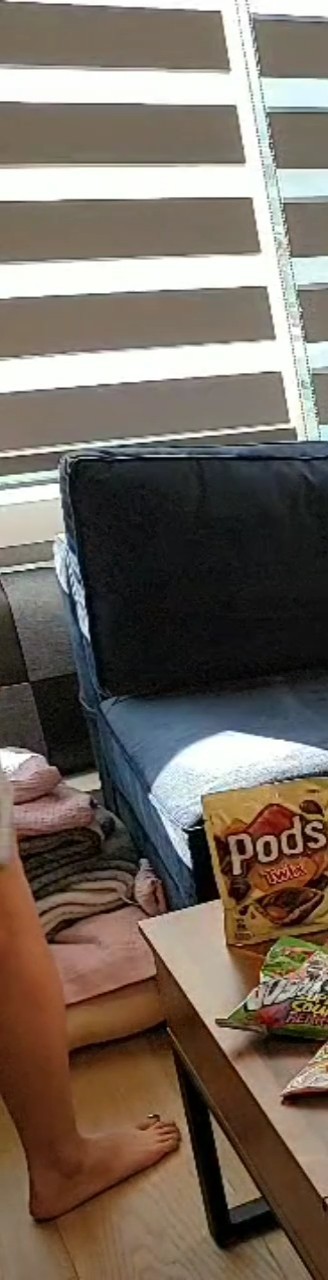
This screenshot has height=1280, width=328. I want to click on table leg, so click(210, 1179).